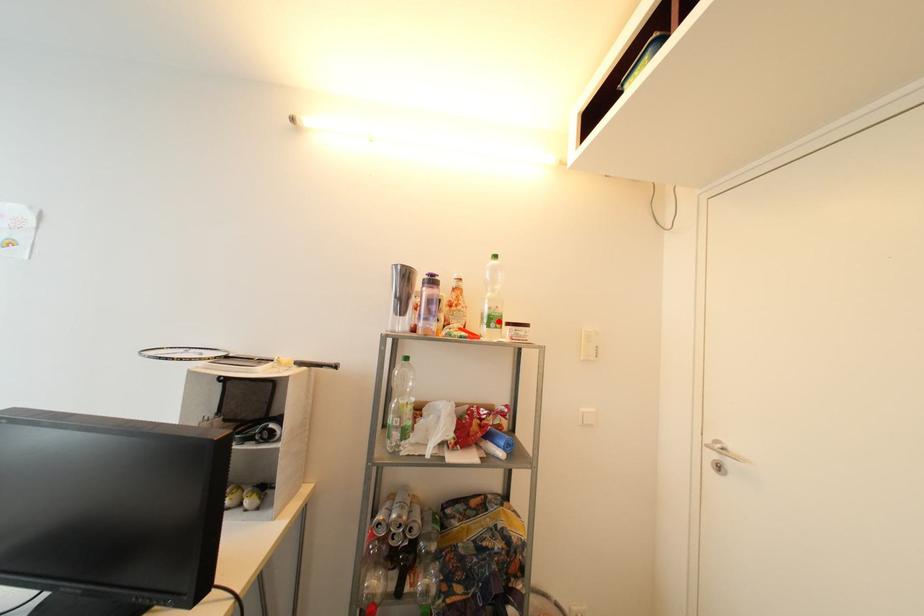
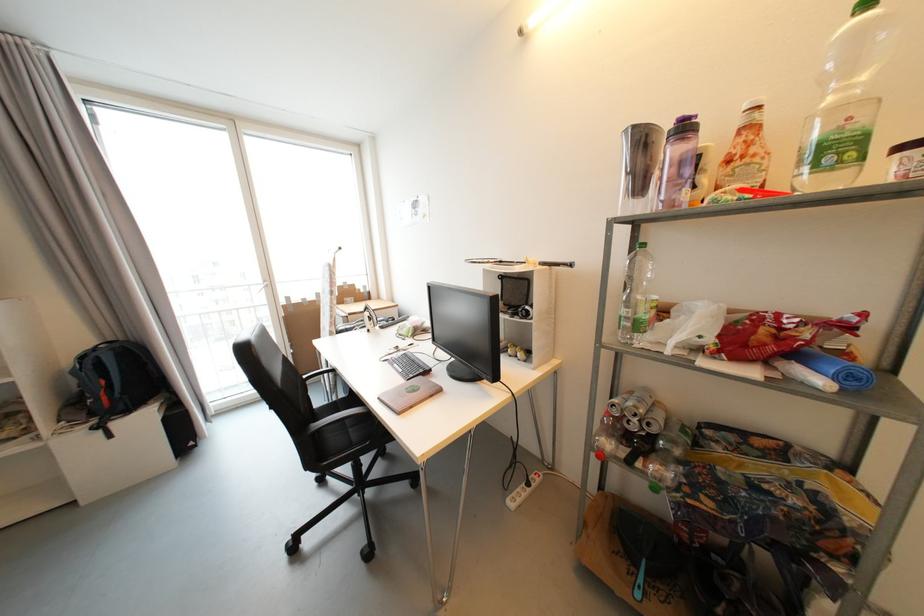
Locate, in the second image, the point that corresponds to the highlighted location in the first image.

(842, 151)